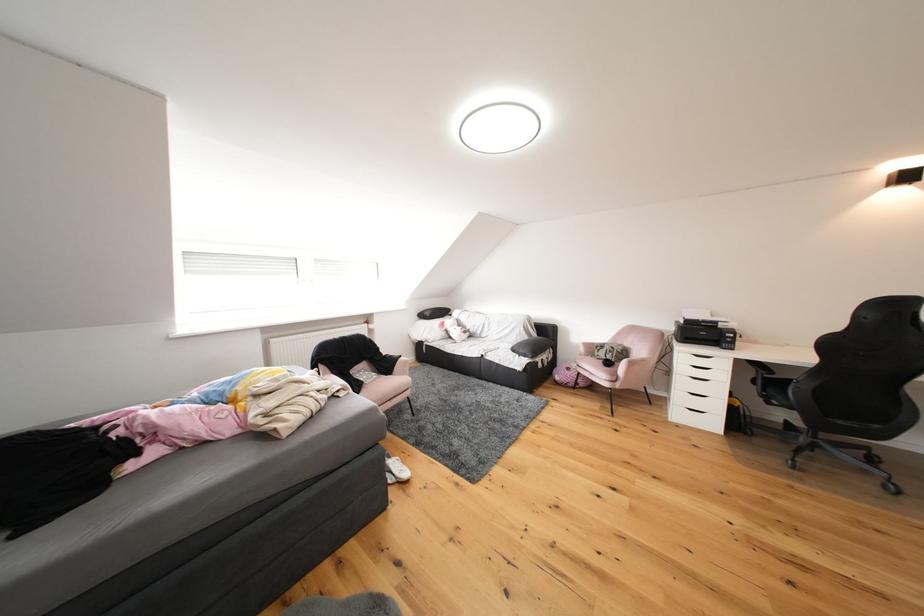
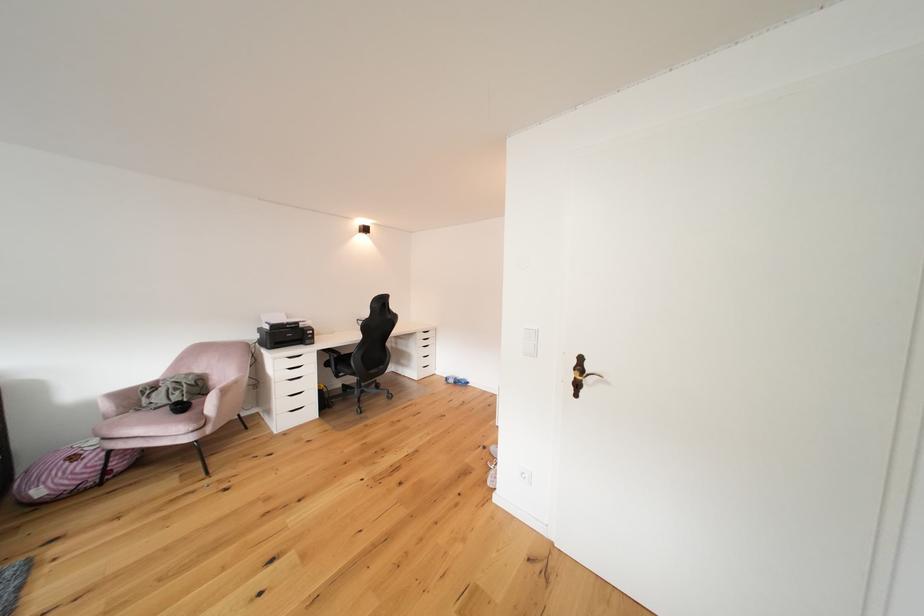
In the second image, find the point that corresponds to point 770,381 in the first image.

(343, 363)